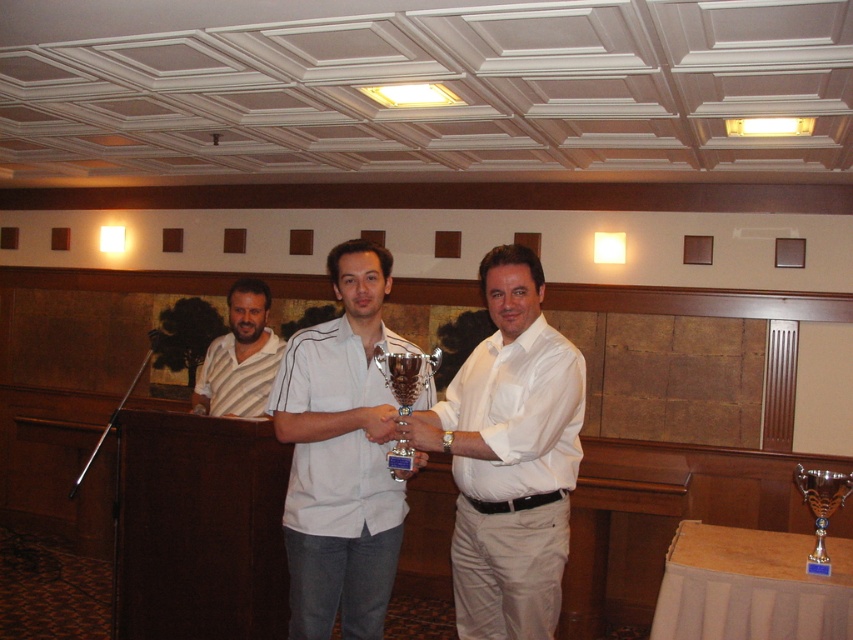
Which of these two, white glossy shirt at center or metallic silver trophy at center, stands shorter?

With less height is metallic silver trophy at center.

Is white glossy shirt at center below metallic silver trophy at center?

Yes.

The image size is (853, 640). In order to click on white glossy shirt at center in this screenshot , I will do `click(509, 456)`.

Which is above, striped cotton shirt at center or metallic silver trophy at center?

striped cotton shirt at center is higher up.

Is striped cotton shirt at center above metallic silver trophy at center?

Correct, striped cotton shirt at center is located above metallic silver trophy at center.

Who is more distant from viewer, (238,355) or (413,371)?

Positioned behind is point (238,355).

This screenshot has width=853, height=640. I want to click on striped cotton shirt at center, so click(241, 356).

Does white matte shirt at center come in front of metallic silver trophy at center?

That is False.

Looking at this image, does white matte shirt at center have a smaller size compared to metallic silver trophy at center?

Actually, white matte shirt at center might be larger than metallic silver trophy at center.

Find the location of a particular element. This screenshot has height=640, width=853. white matte shirt at center is located at coordinates (340, 456).

Find the location of `white matte shirt at center`. white matte shirt at center is located at coordinates (340, 456).